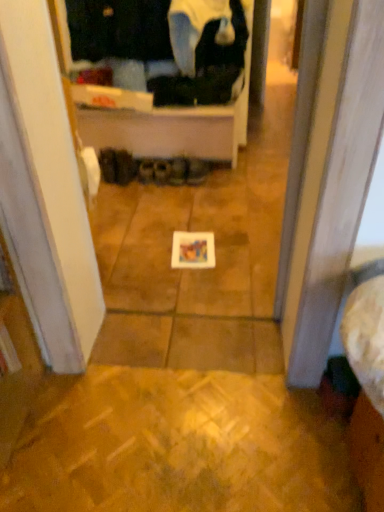
Where is `free point in front of leather brown shoes at center, the sixth footwear from the left`? Image resolution: width=384 pixels, height=512 pixels. free point in front of leather brown shoes at center, the sixth footwear from the left is located at coordinates (205, 191).